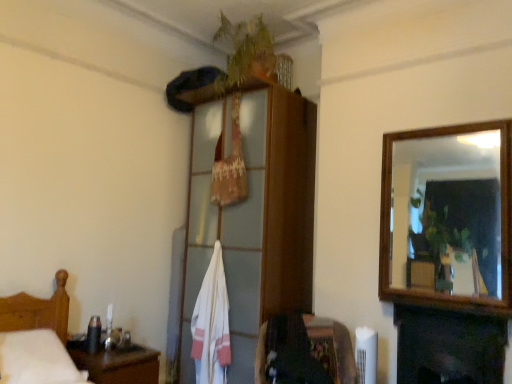
Question: From a real-world perspective, is green leafy plant at upper center below wooden headboard at left?

Choices:
 (A) no
 (B) yes

Answer: (A)

Question: Would you say green leafy plant at upper center is a long distance from wooden headboard at left?

Choices:
 (A) no
 (B) yes

Answer: (B)

Question: Is green leafy plant at upper center to the right of wooden headboard at left from the viewer's perspective?

Choices:
 (A) no
 (B) yes

Answer: (B)

Question: Is green leafy plant at upper center bigger than wooden headboard at left?

Choices:
 (A) no
 (B) yes

Answer: (A)

Question: Is the surface of green leafy plant at upper center in direct contact with wooden headboard at left?

Choices:
 (A) yes
 (B) no

Answer: (B)

Question: From the image's perspective, is green leafy plant at upper center above wooden headboard at left?

Choices:
 (A) no
 (B) yes

Answer: (B)

Question: Is velvet dark brown chair at lower center outside dark wood fireplace at lower right?

Choices:
 (A) yes
 (B) no

Answer: (A)

Question: Would you say dark wood fireplace at lower right is part of velvet dark brown chair at lower center's contents?

Choices:
 (A) yes
 (B) no

Answer: (B)

Question: From the image's perspective, is velvet dark brown chair at lower center located above dark wood fireplace at lower right?

Choices:
 (A) no
 (B) yes

Answer: (A)

Question: Can you confirm if velvet dark brown chair at lower center is positioned to the left of dark wood fireplace at lower right?

Choices:
 (A) no
 (B) yes

Answer: (B)

Question: Would you say velvet dark brown chair at lower center is a long distance from dark wood fireplace at lower right?

Choices:
 (A) yes
 (B) no

Answer: (B)

Question: Considering the relative sizes of velvet dark brown chair at lower center and dark wood fireplace at lower right in the image provided, is velvet dark brown chair at lower center taller than dark wood fireplace at lower right?

Choices:
 (A) no
 (B) yes

Answer: (A)

Question: Is dark wood fireplace at lower right at the right side of wooden cabinet at upper center?

Choices:
 (A) yes
 (B) no

Answer: (A)